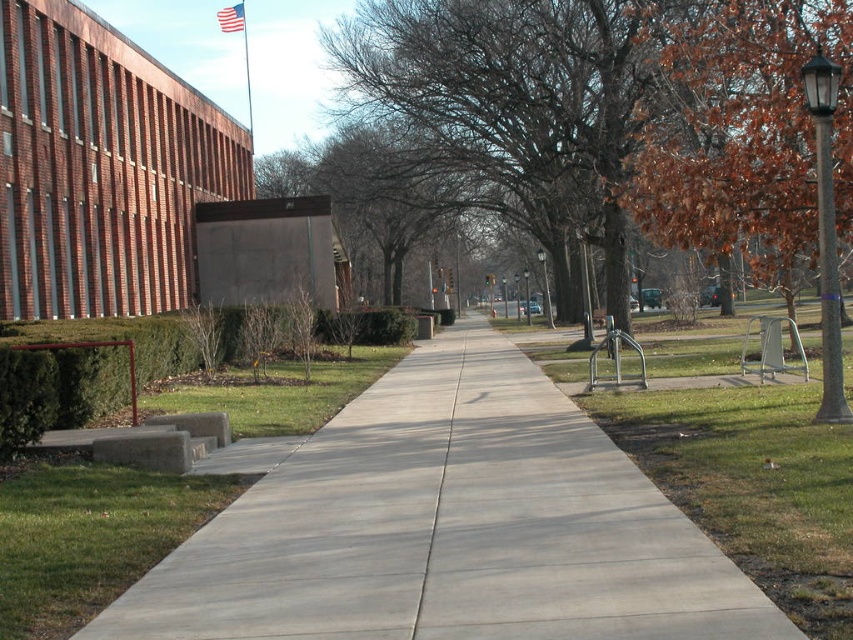
Consider the image. You are standing at the starting point of the sidewalk and want to walk to the end of the gray concrete sidewalk at center. According to the coordinates provided, in which direction should you head?

The gray concrete sidewalk at center is located at coordinates point (450, 525), so you should head towards that direction to reach the end of the gray concrete sidewalk at center.

You are standing on the gray concrete sidewalk at center and want to reach the brown leafy tree at right. Which direction should you move to get closer to the tree?

You should move to the right because the gray concrete sidewalk at center is to the left of the brown leafy tree at right, so moving right along the sidewalk will bring you closer to the tree.

You are a gardener who needs to water the brown leafy tree at right but your watering can only reach 15 feet. You are currently standing on the gray concrete sidewalk at center. Can you reach the tree with your watering can?

The distance between the gray concrete sidewalk at center and the brown leafy tree at right is 19.31 feet, which is farther than the watering can can reach. Therefore, you cannot water the tree from your current position.